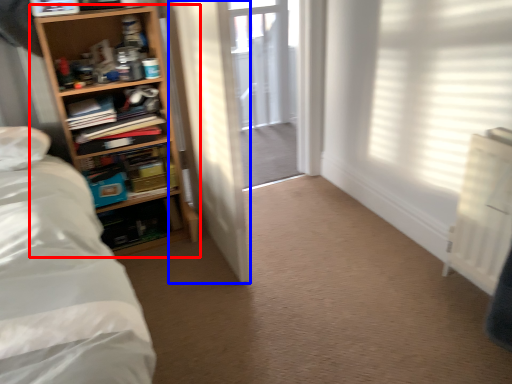
Question: Which object is further to the camera taking this photo, shelf (highlighted by a red box) or door (highlighted by a blue box)?

Choices:
 (A) shelf
 (B) door

Answer: (A)